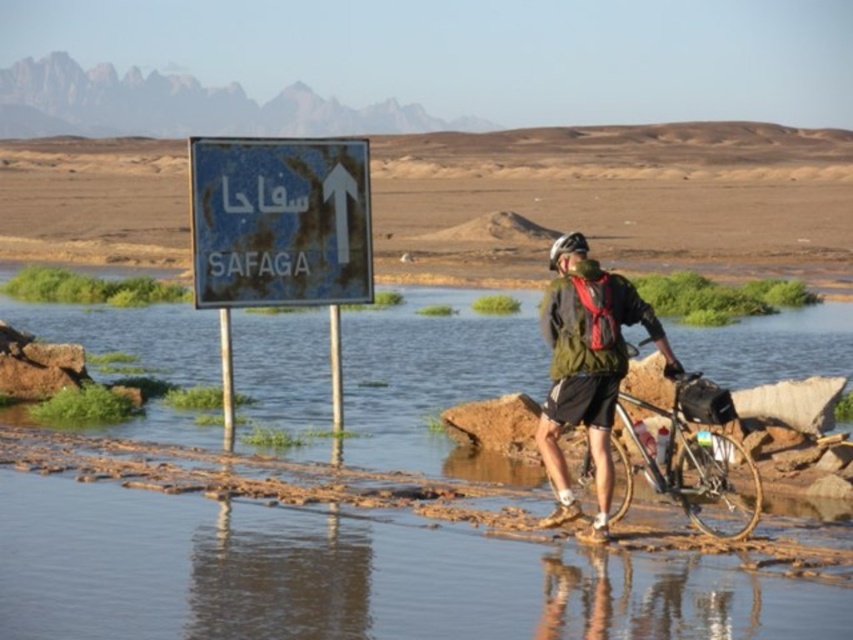
You are a hiker carrying a 1.5 meter long tent pole. You want to place the tent pole horizontally on the ground so that it reaches from your current position to the blue plastic sign at upper center. Is this possible?

The blue plastic sign at upper center is 21.41 meters from the viewer. Since the tent pole is only 1.5 meters long, it cannot reach the sign from your current position.

You are a traveler in the desert and see the point marked at coordinates (x=698, y=458). What object is located there?

The point at (x=698, y=458) indicates a shiny metallic bicycle at center.